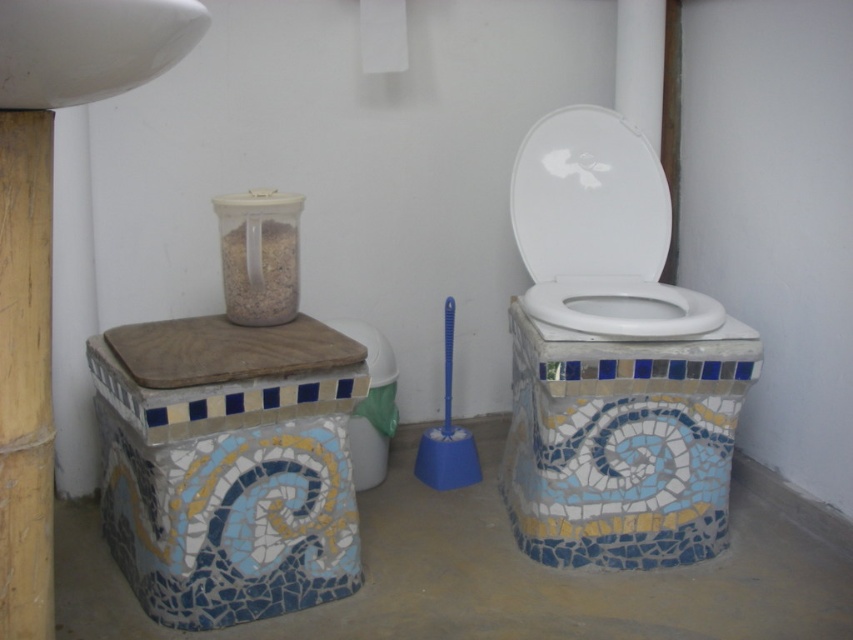
You are a plumber inspecting the bathroom layout. You need to install a new faucet that requires a space wider than the mosaic tile toilet bowl at center. Can the white glossy sink at upper left provide enough space for this installation?

The white glossy sink at upper left is wider than the mosaic tile toilet bowl at center, so it can provide sufficient space for the faucet installation.

You are standing in the bathroom and want to wash your hands. Which object should you use first, the white glossy sink at upper left or the white glossy toilet bowl at center?

You should use the white glossy sink at upper left first because it is closer to you than the white glossy toilet bowl at center.

You are standing in the bathroom and want to locate the point at coordinates (90, 48). Based on the scene description, where would this point be located?

The point at coordinates (90, 48) is on the white glossy sink at upper left.